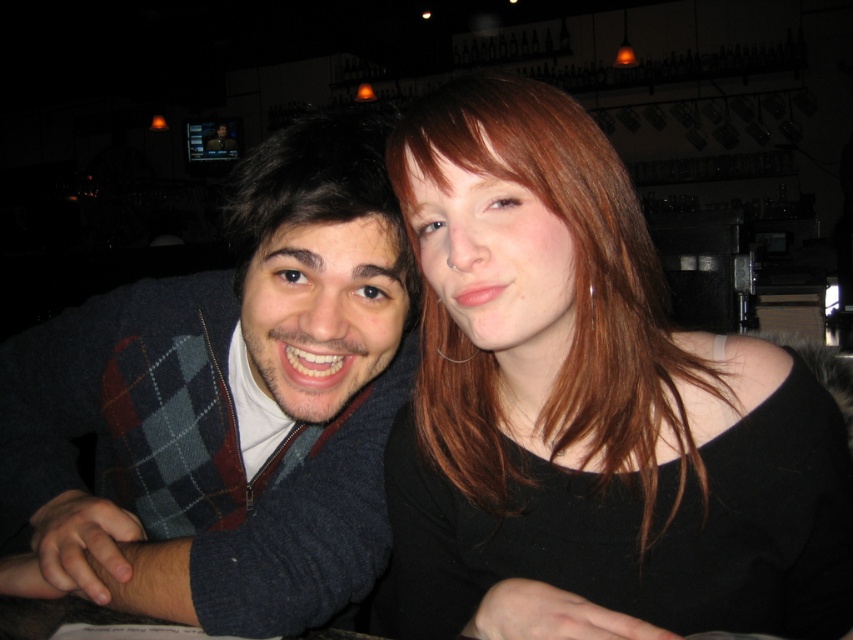
Is matte black shirt at center to the right of dark blue sweater at left from the viewer's perspective?

Correct, you'll find matte black shirt at center to the right of dark blue sweater at left.

Which is behind, point (463, 522) or point (293, 465)?

Positioned behind is point (293, 465).

The image size is (853, 640). I want to click on matte black shirt at center, so click(x=589, y=401).

Does dark blue sweater at left have a lesser height compared to dark brown smooth hair at left?

No.

In the scene shown: Who is more forward, (x=202, y=413) or (x=399, y=260)?

Point (x=399, y=260) is in front.

Between point (97, 364) and point (276, 230), which one is positioned in front?

Point (276, 230) is in front.

Where is `dark blue sweater at left`? The width and height of the screenshot is (853, 640). dark blue sweater at left is located at coordinates (229, 404).

Between point (674, 352) and point (415, 282), which one is positioned in front?

Point (674, 352) is more forward.

Does matte black shirt at center lie in front of dark brown smooth hair at left?

Yes, matte black shirt at center is in front of dark brown smooth hair at left.

Identify the location of matte black shirt at center. This screenshot has height=640, width=853. (589, 401).